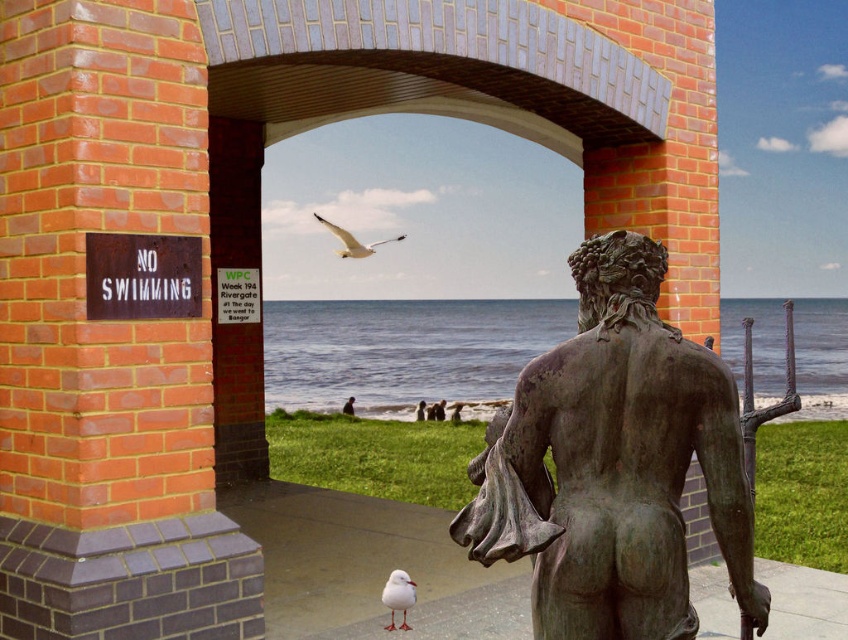
Question: Can you confirm if bronze statue at center is thinner than blue water at center?

Choices:
 (A) no
 (B) yes

Answer: (B)

Question: Can you confirm if white matte bird at lower center is positioned to the left of white feathered bird at center?

Choices:
 (A) no
 (B) yes

Answer: (A)

Question: Which point appears closest to the camera in this image?

Choices:
 (A) (723, 548)
 (B) (442, 392)
 (C) (389, 600)

Answer: (A)

Question: From the image, what is the correct spatial relationship of blue water at center in relation to white matte bird at lower center?

Choices:
 (A) left
 (B) right

Answer: (B)

Question: Among these objects, which one is nearest to the camera?

Choices:
 (A) rusty metal sign at left
 (B) bronze statue at center
 (C) blue water at center

Answer: (B)

Question: Which point appears closest to the camera in this image?

Choices:
 (A) (400, 586)
 (B) (399, 236)
 (C) (478, 323)

Answer: (A)